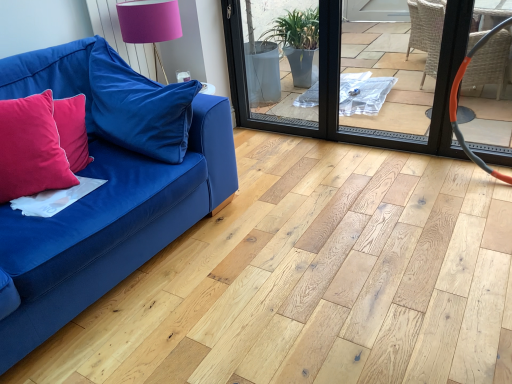
Question: Is velvet blue couch at left facing away from velvet blue pillow at left, arranged as the first pillow when viewed from the right?

Choices:
 (A) no
 (B) yes

Answer: (B)

Question: Is velvet blue pillow at left, arranged as the first pillow when viewed from the right, a part of velvet blue couch at left?

Choices:
 (A) yes
 (B) no

Answer: (A)

Question: Is velvet blue couch at left taller than velvet blue pillow at left, arranged as the first pillow when viewed from the right?

Choices:
 (A) yes
 (B) no

Answer: (A)

Question: Is the depth of velvet blue couch at left greater than that of velvet blue pillow at left, the second pillow viewed from the left?

Choices:
 (A) yes
 (B) no

Answer: (B)

Question: Can you confirm if velvet blue couch at left is wider than velvet blue pillow at left, the second pillow viewed from the left?

Choices:
 (A) yes
 (B) no

Answer: (A)

Question: Is point (82, 112) positioned closer to the camera than point (101, 77)?

Choices:
 (A) closer
 (B) farther

Answer: (A)

Question: Considering the positions of velvet red pillow at left, the second pillow in the right-to-left sequence, and velvet blue couch at left in the image, is velvet red pillow at left, the second pillow in the right-to-left sequence, taller or shorter than velvet blue couch at left?

Choices:
 (A) tall
 (B) short

Answer: (B)

Question: Considering their positions, is velvet red pillow at left, the 1th pillow in the left-to-right sequence, located in front of or behind velvet blue couch at left?

Choices:
 (A) behind
 (B) front

Answer: (A)

Question: Would you say velvet red pillow at left, the 1th pillow in the left-to-right sequence, is inside or outside velvet blue couch at left?

Choices:
 (A) outside
 (B) inside

Answer: (B)

Question: Looking at the image, does pink fabric lampshade at upper center seem bigger or smaller compared to transparent plastic screen door at center?

Choices:
 (A) big
 (B) small

Answer: (B)

Question: From the image's perspective, is pink fabric lampshade at upper center above or below transparent plastic screen door at center?

Choices:
 (A) below
 (B) above

Answer: (B)

Question: From a real-world perspective, is pink fabric lampshade at upper center positioned above or below transparent plastic screen door at center?

Choices:
 (A) below
 (B) above

Answer: (B)

Question: Does point (123, 34) appear closer or farther from the camera than point (322, 115)?

Choices:
 (A) farther
 (B) closer

Answer: (B)

Question: From a real-world perspective, is velvet blue couch at left positioned above or below velvet blue pillow at left, the second pillow viewed from the left?

Choices:
 (A) below
 (B) above

Answer: (A)

Question: From their relative heights in the image, would you say velvet blue couch at left is taller or shorter than velvet blue pillow at left, arranged as the first pillow when viewed from the right?

Choices:
 (A) short
 (B) tall

Answer: (B)